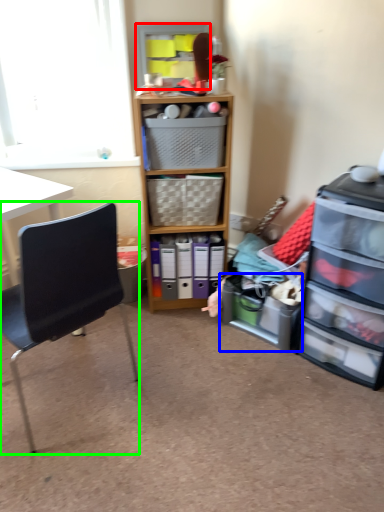
Question: Which is farther away from shelf (highlighted by a red box)? shelf (highlighted by a blue box) or chair (highlighted by a green box)?

Choices:
 (A) shelf
 (B) chair

Answer: (A)